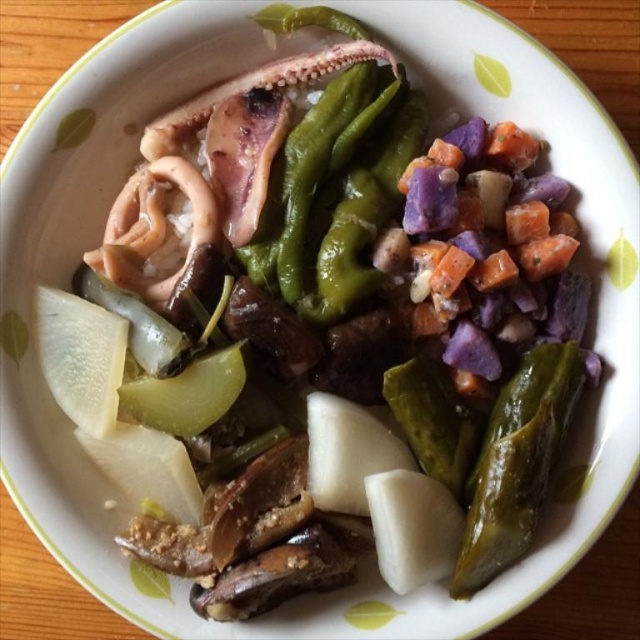
Question: Can you confirm if green glossy pepper at lower right is positioned to the right of orange matte carrot at center-right?

Choices:
 (A) no
 (B) yes

Answer: (B)

Question: Which point is farther to the camera?

Choices:
 (A) (500, 524)
 (B) (445, 282)

Answer: (B)

Question: Does green glossy pepper at lower right appear on the left side of orange matte carrot at center-right?

Choices:
 (A) yes
 (B) no

Answer: (B)

Question: Which of the following is the closest to the observer?

Choices:
 (A) orange matte carrot at center-right
 (B) green glossy pepper at lower right

Answer: (B)

Question: Can you confirm if green glossy pepper at lower right is positioned to the left of orange matte carrot at center-right?

Choices:
 (A) no
 (B) yes

Answer: (A)